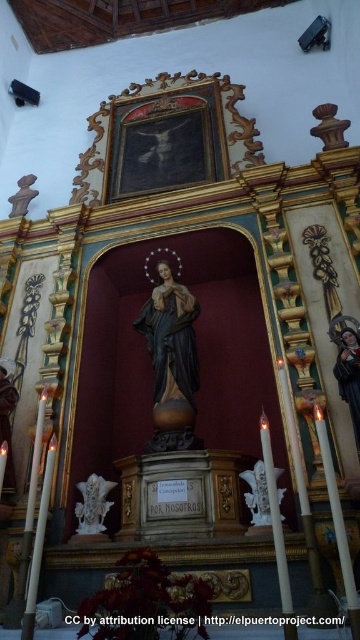
In the scene shown: Can you confirm if smooth skin figure at center is wider than white marble statue at lower left?

In fact, smooth skin figure at center might be narrower than white marble statue at lower left.

Is the position of smooth skin figure at center more distant than that of white marble statue at lower left?

No, it is in front of white marble statue at lower left.

This screenshot has width=360, height=640. Describe the element at coordinates (348, 376) in the screenshot. I see `smooth skin figure at center` at that location.

The width and height of the screenshot is (360, 640). I want to click on smooth skin figure at center, so click(348, 376).

Which is behind, point (105, 502) or point (270, 518)?

Positioned behind is point (105, 502).

Based on the photo, how much distance is there between white marble statue at lower left and white marble statue at center?

22.47 feet

Describe the element at coordinates (92, 504) in the screenshot. The height and width of the screenshot is (640, 360). I see `white marble statue at lower left` at that location.

Locate an element on the screen. The width and height of the screenshot is (360, 640). white marble statue at lower left is located at coordinates (92, 504).

Is matte brown statue at center to the left of smooth skin figure at center from the viewer's perspective?

Correct, you'll find matte brown statue at center to the left of smooth skin figure at center.

In order to click on matte brown statue at center in this screenshot , I will do `click(171, 337)`.